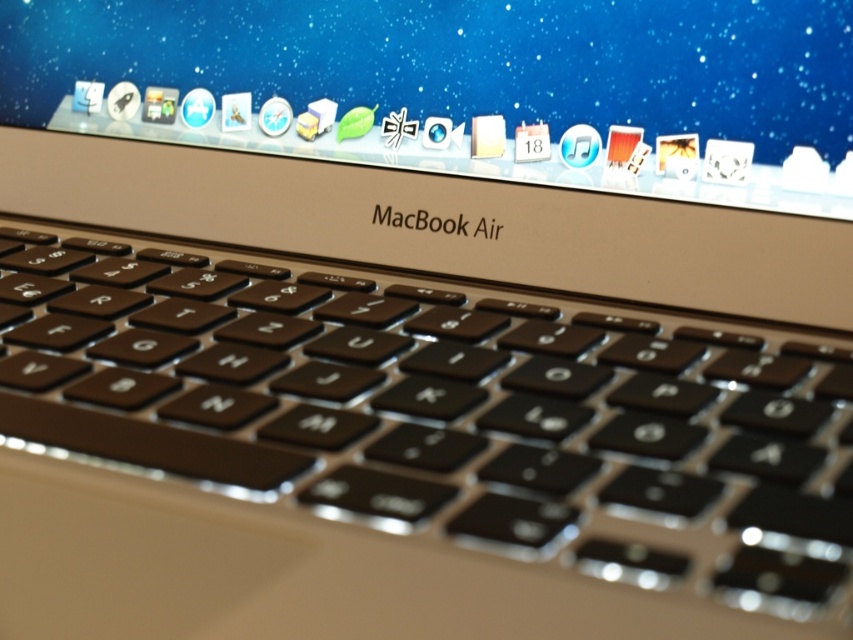
Question: Can you confirm if black matte keyboard at center is wider than satin silver macbook air at center?

Choices:
 (A) no
 (B) yes

Answer: (A)

Question: Among these objects, which one is farthest from the camera?

Choices:
 (A) satin silver macbook air at center
 (B) black matte keyboard at center

Answer: (A)

Question: Is black matte keyboard at center thinner than satin silver macbook air at center?

Choices:
 (A) no
 (B) yes

Answer: (B)

Question: Is black matte keyboard at center bigger than satin silver macbook air at center?

Choices:
 (A) yes
 (B) no

Answer: (A)

Question: Among these objects, which one is nearest to the camera?

Choices:
 (A) black matte keyboard at center
 (B) satin silver macbook air at center

Answer: (A)

Question: Which object appears closest to the camera in this image?

Choices:
 (A) satin silver macbook air at center
 (B) black matte keyboard at center

Answer: (B)